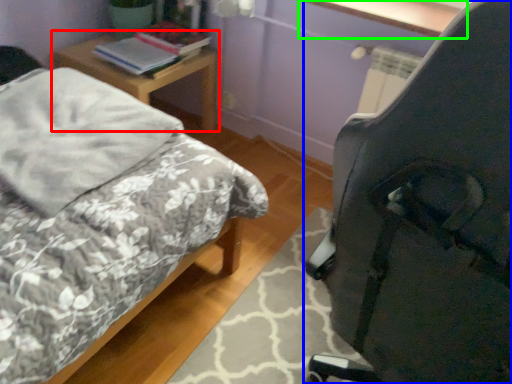
Question: Which is farther away from nightstand (highlighted by a red box)? chair (highlighted by a blue box) or window sill (highlighted by a green box)?

Choices:
 (A) chair
 (B) window sill

Answer: (A)